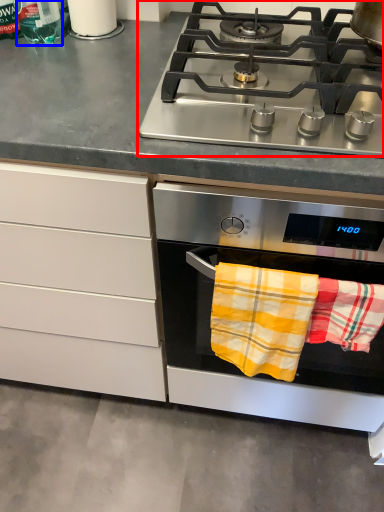
Question: Which object appears closest to the camera in this image, gas stove (highlighted by a red box) or bottle (highlighted by a blue box)?

Choices:
 (A) gas stove
 (B) bottle

Answer: (A)